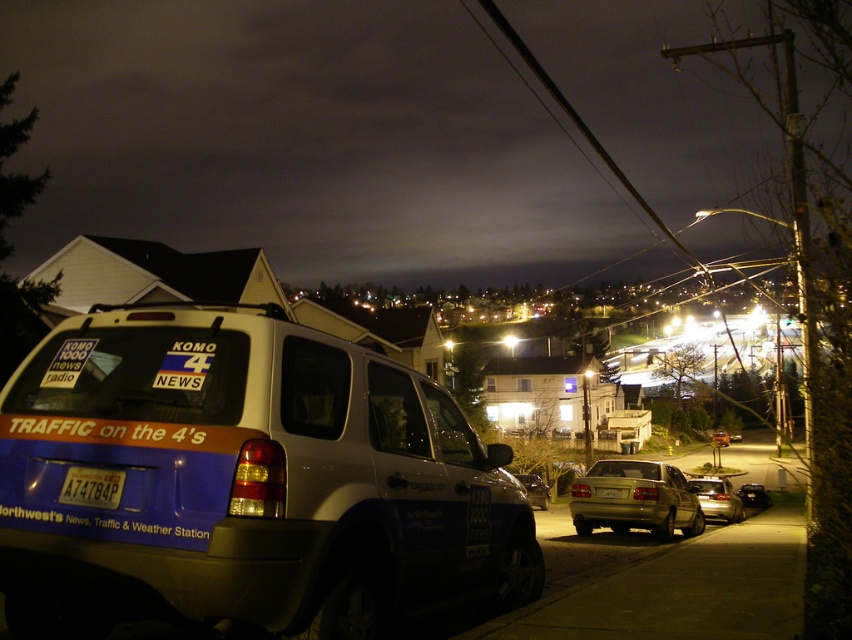
Does silver metallic minivan at center lie behind white plastic license plate at center?

No, silver metallic minivan at center is closer to the viewer.

Between silver metallic minivan at center and white plastic license plate at center, which one has more height?

silver metallic minivan at center

What do you see at coordinates (245, 481) in the screenshot? This screenshot has width=852, height=640. I see `silver metallic minivan at center` at bounding box center [245, 481].

Where is `silver metallic minivan at center`? silver metallic minivan at center is located at coordinates (245, 481).

Can you confirm if metallic wire at upper center is positioned above white plastic license plate at center?

Indeed, metallic wire at upper center is positioned over white plastic license plate at center.

Does metallic wire at upper center have a greater width compared to white plastic license plate at center?

Yes, metallic wire at upper center is wider than white plastic license plate at center.

Is point (522, 49) positioned after point (608, 486)?

Yes, it is.

Identify the location of metallic wire at upper center. (579, 122).

Can you confirm if metallic gold sedan at center is positioned to the right of white plastic license plate at center?

Indeed, metallic gold sedan at center is positioned on the right side of white plastic license plate at center.

Is metallic gold sedan at center bigger than white plastic license plate at center?

Indeed, metallic gold sedan at center has a larger size compared to white plastic license plate at center.

Locate an element on the screen. The height and width of the screenshot is (640, 852). metallic gold sedan at center is located at coordinates (636, 499).

The height and width of the screenshot is (640, 852). Find the location of `metallic gold sedan at center`. metallic gold sedan at center is located at coordinates (636, 499).